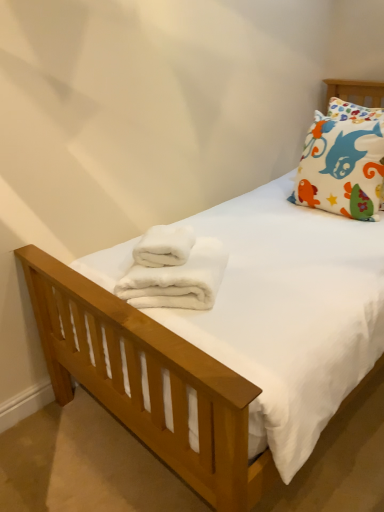
Where is `white fluffy bath towel at center, the first bath towel when ordered from top to bottom`? The height and width of the screenshot is (512, 384). white fluffy bath towel at center, the first bath towel when ordered from top to bottom is located at coordinates (164, 246).

Where is `white fluffy bath towel at center, the 1th bath towel positioned from the bottom`? white fluffy bath towel at center, the 1th bath towel positioned from the bottom is located at coordinates (174, 270).

Based on the photo, could you tell me if white cotton pillow at upper right is facing white fluffy bath towel at center, which appears as the 2th bath towel when ordered from the bottom?

Yes, white cotton pillow at upper right is oriented towards white fluffy bath towel at center, which appears as the 2th bath towel when ordered from the bottom.

Between white cotton pillow at upper right and white fluffy bath towel at center, the first bath towel when ordered from top to bottom, which one has more height?

With more height is white cotton pillow at upper right.

Is there a large distance between white cotton pillow at upper right and white fluffy bath towel at center, the first bath towel when ordered from top to bottom?

No, white cotton pillow at upper right is in close proximity to white fluffy bath towel at center, the first bath towel when ordered from top to bottom.

Identify the location of bath towel that is the 1st one below the white cotton pillow at upper right (from a real-world perspective). [x=164, y=246].

From a real-world perspective, is white fluffy bath towel at center, the first bath towel when ordered from top to bottom, positioned above or below white cotton pillow at upper right?

From a real-world perspective, white fluffy bath towel at center, the first bath towel when ordered from top to bottom, is physically below white cotton pillow at upper right.

How distant is white fluffy bath towel at center, the first bath towel when ordered from top to bottom, from white cotton pillow at upper right?

A distance of 34.54 inches exists between white fluffy bath towel at center, the first bath towel when ordered from top to bottom, and white cotton pillow at upper right.

Is white fluffy bath towel at center, which appears as the 2th bath towel when ordered from the bottom, bigger than white cotton pillow at upper right?

No.

Image resolution: width=384 pixels, height=512 pixels. What are the coordinates of `pillow above the white fluffy bath towel at center, the first bath towel when ordered from top to bottom (from a real-world perspective)` in the screenshot? It's located at (343, 162).

In the scene shown: From the image's perspective, which one is positioned higher, white cotton pillow at upper right or white fluffy bath towel at center, the 1th bath towel positioned from the bottom?

white cotton pillow at upper right appears higher in the image.

Could white fluffy bath towel at center, the 1th bath towel positioned from the bottom, be considered to be inside white cotton pillow at upper right?

No, white fluffy bath towel at center, the 1th bath towel positioned from the bottom, is not inside white cotton pillow at upper right.

Does white cotton pillow at upper right appear on the right side of white fluffy bath towel at center, the 1th bath towel positioned from the bottom?

Correct, you'll find white cotton pillow at upper right to the right of white fluffy bath towel at center, the 1th bath towel positioned from the bottom.

Are white cotton pillow at upper right and white fluffy bath towel at center, the second bath towel in the top-to-bottom sequence, making contact?

No, white cotton pillow at upper right is not touching white fluffy bath towel at center, the second bath towel in the top-to-bottom sequence.

How distant is white fluffy bath towel at center, the second bath towel in the top-to-bottom sequence, from white cotton pillow at upper right?

white fluffy bath towel at center, the second bath towel in the top-to-bottom sequence, is 34.65 inches away from white cotton pillow at upper right.

Considering the positions of points (207, 283) and (330, 201), is point (207, 283) closer to camera compared to point (330, 201)?

Yes.

Is white fluffy bath towel at center, the 1th bath towel positioned from the bottom, oriented away from white cotton pillow at upper right?

No.

Does white fluffy bath towel at center, the 1th bath towel positioned from the bottom, lie in front of white cotton pillow at upper right?

Yes, it is.

Which of these two, white fluffy bath towel at center, which appears as the 2th bath towel when ordered from the bottom, or white fluffy bath towel at center, the second bath towel in the top-to-bottom sequence, is smaller?

white fluffy bath towel at center, which appears as the 2th bath towel when ordered from the bottom.

Does white fluffy bath towel at center, which appears as the 2th bath towel when ordered from the bottom, have a lesser width compared to white fluffy bath towel at center, the second bath towel in the top-to-bottom sequence?

Yes, white fluffy bath towel at center, which appears as the 2th bath towel when ordered from the bottom, is thinner than white fluffy bath towel at center, the second bath towel in the top-to-bottom sequence.

Is white fluffy bath towel at center, the first bath towel when ordered from top to bottom, aimed at white fluffy bath towel at center, the second bath towel in the top-to-bottom sequence?

Yes, white fluffy bath towel at center, the first bath towel when ordered from top to bottom, is aimed at white fluffy bath towel at center, the second bath towel in the top-to-bottom sequence.

Which point is more distant from viewer, (169, 239) or (155, 228)?

Point (155, 228)

From a real-world perspective, between white fluffy bath towel at center, the second bath towel in the top-to-bottom sequence, and white fluffy bath towel at center, which appears as the 2th bath towel when ordered from the bottom, who is vertically lower?

white fluffy bath towel at center, the second bath towel in the top-to-bottom sequence.

Could you tell me if white fluffy bath towel at center, the 1th bath towel positioned from the bottom, is facing white fluffy bath towel at center, the first bath towel when ordered from top to bottom?

No, white fluffy bath towel at center, the 1th bath towel positioned from the bottom, is not oriented towards white fluffy bath towel at center, the first bath towel when ordered from top to bottom.

Which of these two, white fluffy bath towel at center, the 1th bath towel positioned from the bottom, or white fluffy bath towel at center, the first bath towel when ordered from top to bottom, stands shorter?

With less height is white fluffy bath towel at center, the first bath towel when ordered from top to bottom.

Between white fluffy bath towel at center, the second bath towel in the top-to-bottom sequence, and white fluffy bath towel at center, which appears as the 2th bath towel when ordered from the bottom, which one appears on the left side from the viewer's perspective?

white fluffy bath towel at center, which appears as the 2th bath towel when ordered from the bottom.

At what (x,y) coordinates should I click in order to perform the action: click on pillow above the white fluffy bath towel at center, the first bath towel when ordered from top to bottom (from the image's perspective). Please return your answer as a coordinate pair (x, y). Looking at the image, I should click on (343, 162).

Find the location of `the 1st bath towel in front of the white cotton pillow at upper right, counting from the anchor's position`. the 1st bath towel in front of the white cotton pillow at upper right, counting from the anchor's position is located at coordinates (164, 246).

Based on their spatial positions, is white fluffy bath towel at center, which appears as the 2th bath towel when ordered from the bottom, or white fluffy bath towel at center, the second bath towel in the top-to-bottom sequence, closer to white cotton pillow at upper right?

Among the two, white fluffy bath towel at center, which appears as the 2th bath towel when ordered from the bottom, is located nearer to white cotton pillow at upper right.

Looking at the image, which one is located closer to white fluffy bath towel at center, which appears as the 2th bath towel when ordered from the bottom, white cotton pillow at upper right or white fluffy bath towel at center, the second bath towel in the top-to-bottom sequence?

Based on the image, white fluffy bath towel at center, the second bath towel in the top-to-bottom sequence, appears to be nearer to white fluffy bath towel at center, which appears as the 2th bath towel when ordered from the bottom.

Which object lies nearer to the anchor point white fluffy bath towel at center, which appears as the 2th bath towel when ordered from the bottom, white fluffy bath towel at center, the 1th bath towel positioned from the bottom, or white cotton pillow at upper right?

white fluffy bath towel at center, the 1th bath towel positioned from the bottom, is positioned closer to the anchor white fluffy bath towel at center, which appears as the 2th bath towel when ordered from the bottom.

Which object lies further to the anchor point white cotton pillow at upper right, white fluffy bath towel at center, the second bath towel in the top-to-bottom sequence, or white fluffy bath towel at center, which appears as the 2th bath towel when ordered from the bottom?

white fluffy bath towel at center, the second bath towel in the top-to-bottom sequence.

Estimate the real-world distances between objects in this image. Which object is closer to white fluffy bath towel at center, the second bath towel in the top-to-bottom sequence, white fluffy bath towel at center, which appears as the 2th bath towel when ordered from the bottom, or white cotton pillow at upper right?

white fluffy bath towel at center, which appears as the 2th bath towel when ordered from the bottom, lies closer to white fluffy bath towel at center, the second bath towel in the top-to-bottom sequence, than the other object.

From the picture: Considering their positions, is white cotton pillow at upper right positioned further to white fluffy bath towel at center, the 1th bath towel positioned from the bottom, than white fluffy bath towel at center, which appears as the 2th bath towel when ordered from the bottom?

white cotton pillow at upper right is positioned further to the anchor white fluffy bath towel at center, the 1th bath towel positioned from the bottom.

What are the coordinates of `bath towel between white fluffy bath towel at center, the first bath towel when ordered from top to bottom, and white cotton pillow at upper right from left to right` in the screenshot? It's located at (174, 270).